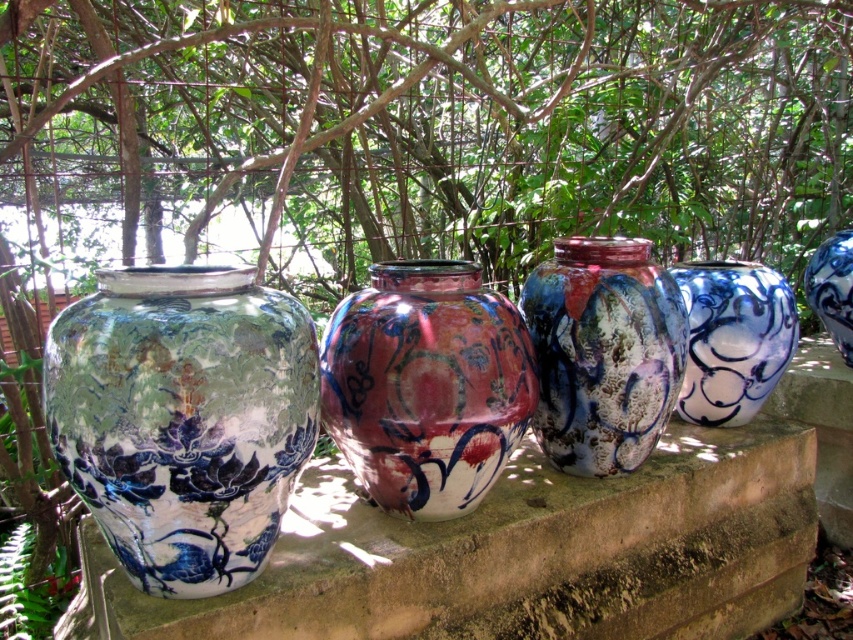
You are standing in front of the jars and want to place a small decoration. You have two points marked on the jars at coordinates point [260,301] and point [711,353]. Which point is closer to you?

Point [260,301] is closer to the camera than point [711,353], so the point at [260,301] is closer to you.

You are an art curator arranging an exhibition. You have two items to display in a narrow space. The shiny ceramic vase at center and the blue glossy jar at right. Given their sizes, which one should be placed closer to the entrance to ensure visitors can easily view both items without feeling crowded?

The shiny ceramic vase at center is bigger than the blue glossy jar at right, so placing the smaller blue glossy jar at right closer to the entrance will allow visitors to comfortably view both items without feeling crowded by the larger vase.

You are an art curator arranging an exhibition. You need to place a tall sculpture between the blue and white glazed vase at left and the blue glossy jar at right. Which side of the vase should the sculpture be placed on to ensure it doesn

The blue and white glazed vase at left is taller than the blue glossy jar at right. To place the tall sculpture between them, position it on the side of the blue and white glazed vase at left so that the sculpture aligns with the height of the taller object.